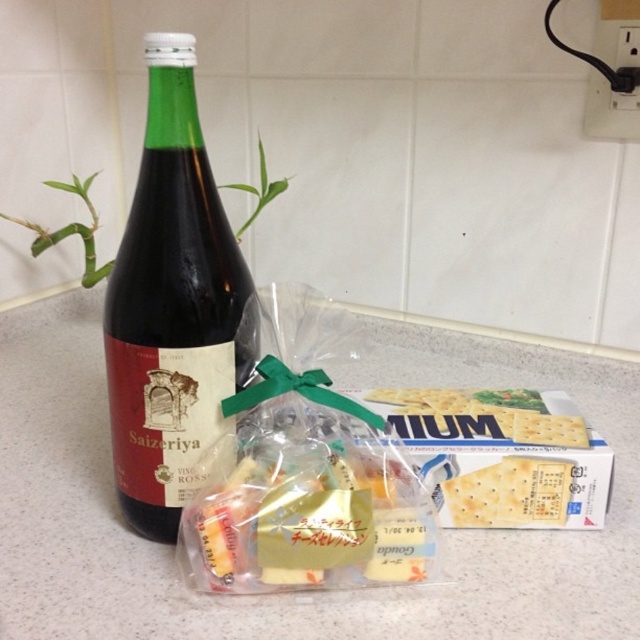
Question: Is the position of white matte crackers at center more distant than that of light brown crisp at center?

Choices:
 (A) yes
 (B) no

Answer: (A)

Question: Is green glass bottle at left smaller than white matte crackers at center?

Choices:
 (A) yes
 (B) no

Answer: (B)

Question: Is white matte crackers at center above light brown crisp at center?

Choices:
 (A) no
 (B) yes

Answer: (B)

Question: Which object is positioned farthest from the light brown crisp at center?

Choices:
 (A) green glass bottle at left
 (B) white matte crackers at center

Answer: (A)

Question: Which point appears farthest from the camera in this image?

Choices:
 (A) (166, 108)
 (B) (554, 490)
 (C) (378, 394)

Answer: (C)

Question: Which object is closer to the camera taking this photo?

Choices:
 (A) light brown crisp at center
 (B) white matte crackers at center
 (C) green glass bottle at left

Answer: (C)